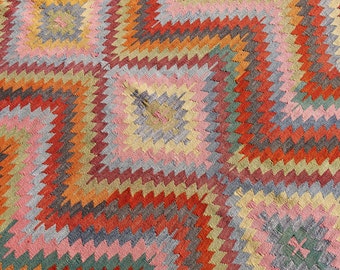
Where is `rug or blanket`? rug or blanket is located at coordinates (121, 132).